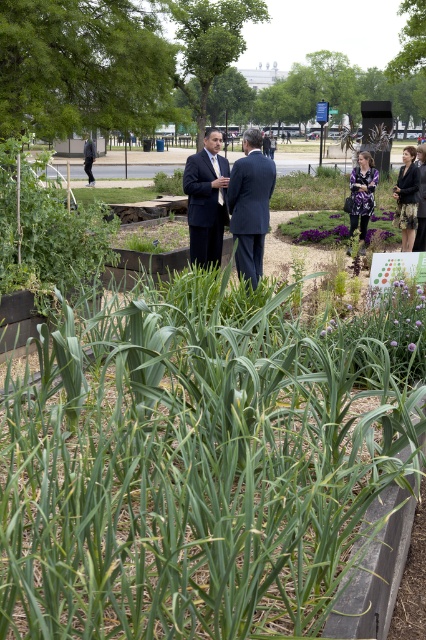
You are a photographer trying to capture a photo of the purple floral dress at center without the green leafy plant at left blocking the view. Based on their positions, can you position yourself in a way to avoid the plant blocking the dress?

The green leafy plant at left is in front of the purple floral dress at center, so you would need to move to a position where the dress is no longer behind the plant. Since the plant is in front, moving to the side opposite the plant might allow you to see the dress without obstruction.

You are a visitor in the garden and want to take a photo of the green leafy plant at left and the dark blue suit at center. Can you frame both in the same shot without moving either?

The green leafy plant at left is below the dark blue suit at center, so you can frame both in the same shot by adjusting your camera angle to include both the lower plant and the higher suit.